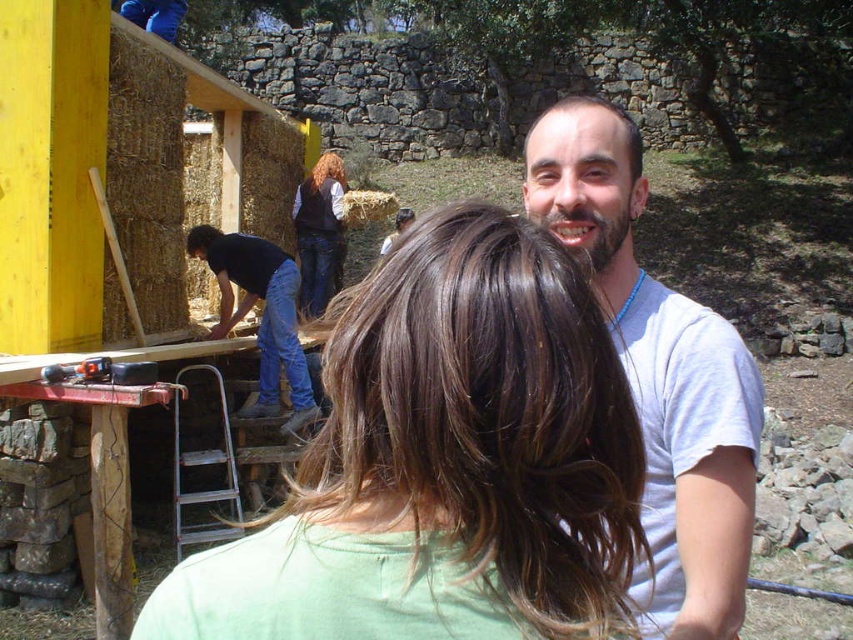
You are standing in the construction site and see the point marked at coordinates (260,314). What object is located at that point?

The point at coordinates (260,314) marks blue jeans at left.

Based on the photo, you are standing in the construction site and want to locate the blue jeans at left. According to the coordinates provided, where exactly would you find them?

The blue jeans at left are located at point 0.492 on the x axis and 0.307 on the y axis.